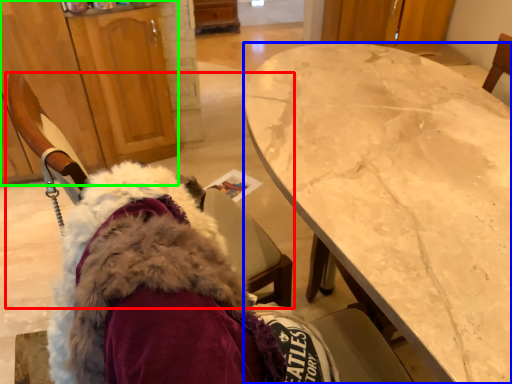
Question: Which is farther away from chair (highlighted by a red box)? desk (highlighted by a blue box) or cabinetry (highlighted by a green box)?

Choices:
 (A) desk
 (B) cabinetry

Answer: (B)